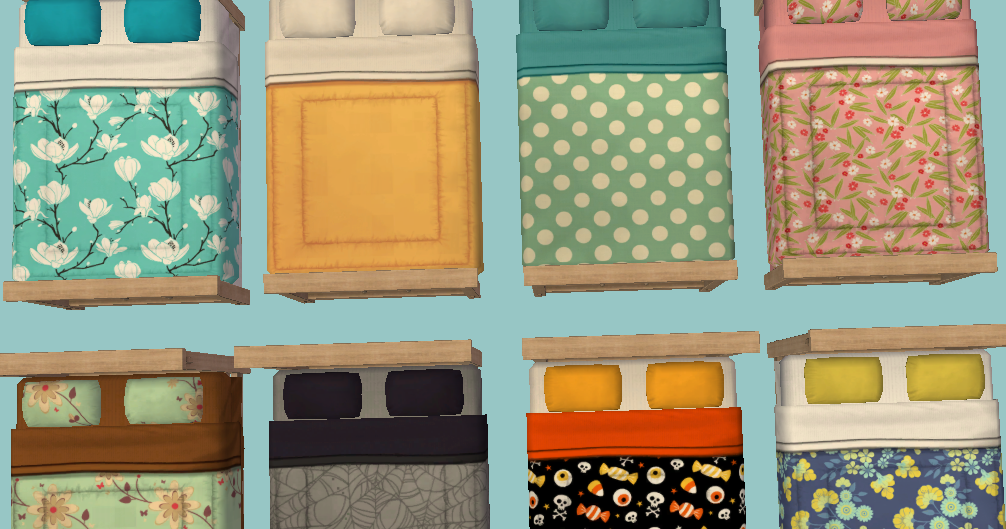
You are a GUI agent. You are given a task and a screenshot of the screen. Output one action in this format:
    pyautogui.click(x=<x>, y=<y>)
    Task: Click on the headboards
    Image resolution: width=1006 pixels, height=529 pixels.
    Given the screenshot: What is the action you would take?
    pyautogui.click(x=101, y=364), pyautogui.click(x=386, y=346), pyautogui.click(x=654, y=346), pyautogui.click(x=935, y=333)